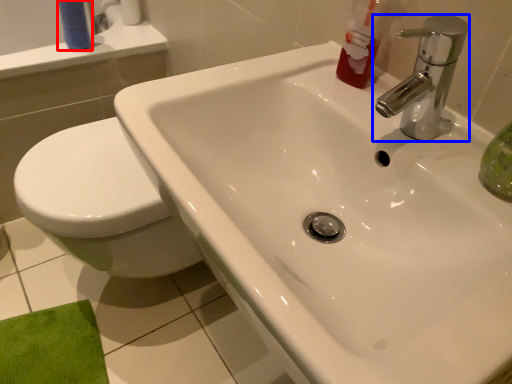
Question: Which object appears farthest to the camera in this image, toiletry (highlighted by a red box) or tap (highlighted by a blue box)?

Choices:
 (A) toiletry
 (B) tap

Answer: (A)